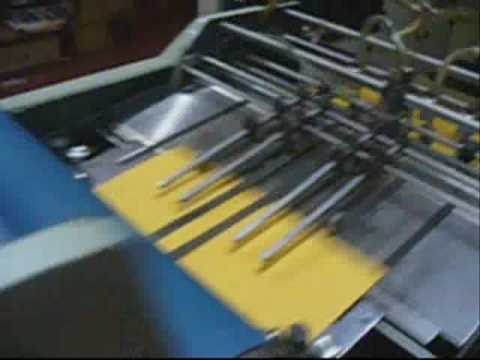
What are the coordinates of `rod` in the screenshot? It's located at (230, 141).